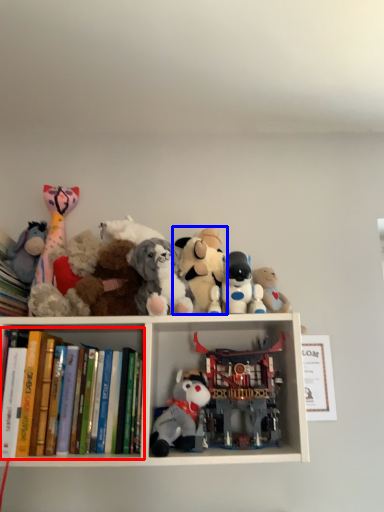
Question: Which object appears farthest to the camera in this image, book (highlighted by a red box) or toy (highlighted by a blue box)?

Choices:
 (A) book
 (B) toy

Answer: (B)